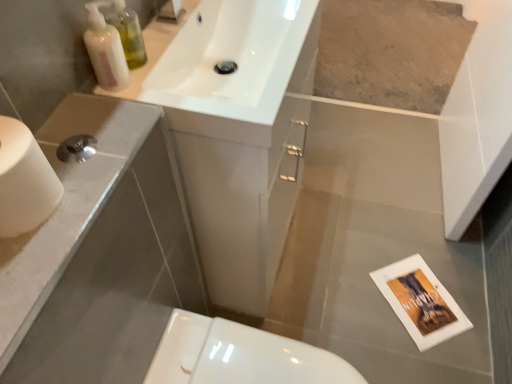
Question: Could you tell me if white glossy toilet at lower center is turned towards white glossy sink at upper center?

Choices:
 (A) no
 (B) yes

Answer: (A)

Question: Could white glossy sink at upper center be considered to be inside white glossy toilet at lower center?

Choices:
 (A) yes
 (B) no

Answer: (B)

Question: Is white glossy sink at upper center at the back of white glossy toilet at lower center?

Choices:
 (A) yes
 (B) no

Answer: (B)

Question: Is white glossy toilet at lower center wider than white glossy sink at upper center?

Choices:
 (A) yes
 (B) no

Answer: (A)

Question: Is white glossy toilet at lower center further to the viewer compared to white glossy sink at upper center?

Choices:
 (A) no
 (B) yes

Answer: (B)

Question: From a real-world perspective, is translucent plastic bottles at upper left above or below white glossy soap dispenser at upper left?

Choices:
 (A) below
 (B) above

Answer: (B)

Question: From their relative heights in the image, would you say translucent plastic bottles at upper left is taller or shorter than white glossy soap dispenser at upper left?

Choices:
 (A) tall
 (B) short

Answer: (A)

Question: Is translucent plastic bottles at upper left spatially inside white glossy soap dispenser at upper left, or outside of it?

Choices:
 (A) outside
 (B) inside

Answer: (A)

Question: Does point (110, 21) appear closer or farther from the camera than point (95, 43)?

Choices:
 (A) farther
 (B) closer

Answer: (A)

Question: Looking at the image, does white glossy sink at upper center seem bigger or smaller compared to white glossy toilet at lower center?

Choices:
 (A) big
 (B) small

Answer: (A)

Question: Does point (155, 81) appear closer or farther from the camera than point (201, 382)?

Choices:
 (A) farther
 (B) closer

Answer: (A)

Question: From the image's perspective, is white glossy sink at upper center located above or below white glossy toilet at lower center?

Choices:
 (A) below
 (B) above

Answer: (B)

Question: Is white glossy sink at upper center in front of or behind white glossy toilet at lower center in the image?

Choices:
 (A) behind
 (B) front

Answer: (B)

Question: Relative to white matte toilet paper at left, is white glossy toilet at lower center in front or behind?

Choices:
 (A) behind
 (B) front

Answer: (A)

Question: Looking at their shapes, would you say white glossy toilet at lower center is wider or thinner than white matte toilet paper at left?

Choices:
 (A) thin
 (B) wide

Answer: (B)